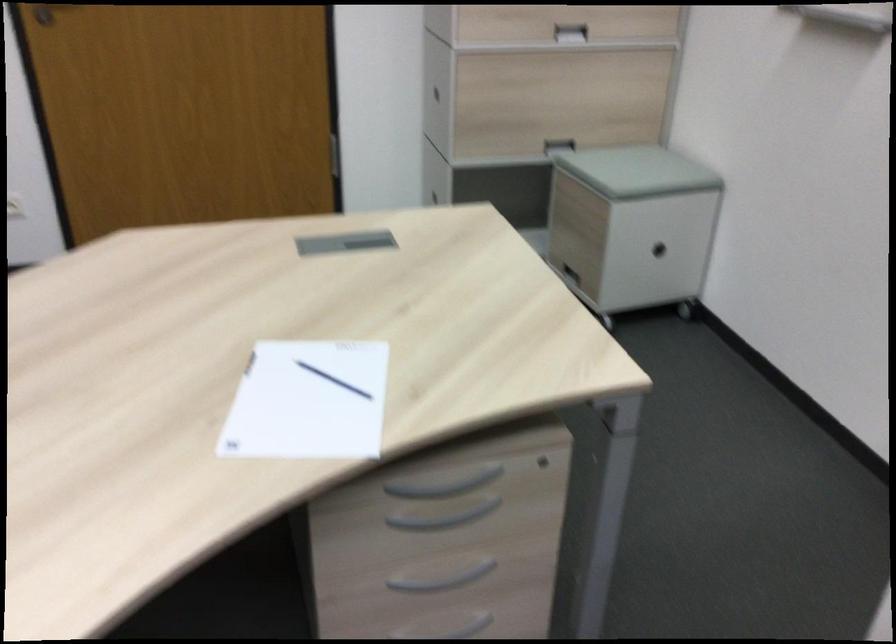
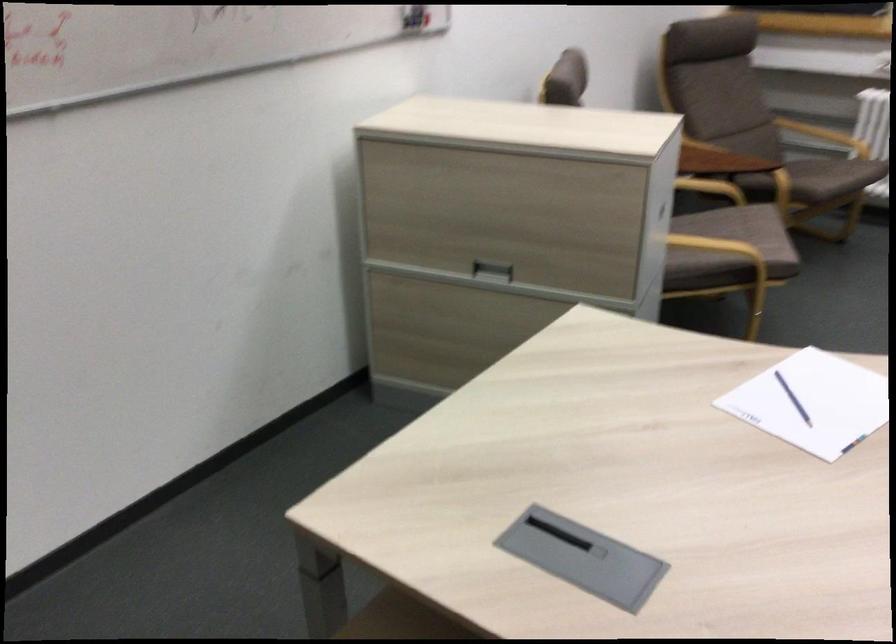
Question: I am providing you with two images of the same scene from different viewpoints. After the viewpoint changes to image2, which objects are now occluded?

Choices:
 (A) blue 'Iris' book
 (B) grey drawer handle
 (C) chair armrest
 (D) blue pencil

Answer: (B)